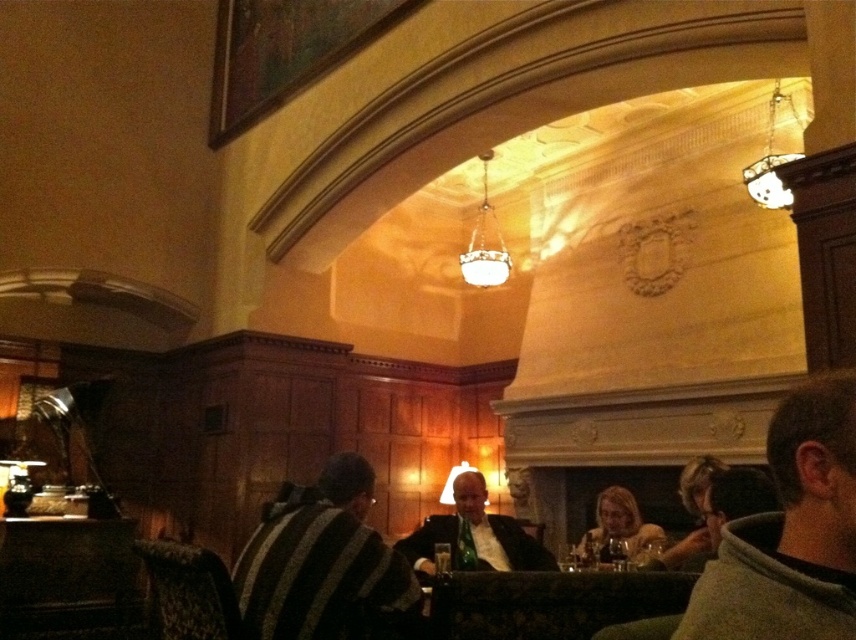
Question: Among these objects, which one is farthest from the camera?

Choices:
 (A) light brown leather jacket at center
 (B) dark gray sweater at right
 (C) matte black suit at center

Answer: (A)

Question: Observing the image, what is the correct spatial positioning of light brown leather jacket at center in reference to white glass chandelier at center?

Choices:
 (A) above
 (B) below

Answer: (B)

Question: Estimate the real-world distances between objects in this image. Which object is farther from the light brown leather jacket at center?

Choices:
 (A) matte black suit at center
 (B) striped sweater at center
 (C) wooden table at center

Answer: (B)

Question: Does matte black suit at center appear on the right side of light brown leather jacket at center?

Choices:
 (A) yes
 (B) no

Answer: (B)

Question: Does wooden table at center come in front of matte black suit at center?

Choices:
 (A) no
 (B) yes

Answer: (B)

Question: Which of the following is the farthest from the observer?

Choices:
 (A) matte black suit at center
 (B) dark gray sweater at right
 (C) light brown leather jacket at center
 (D) white glass chandelier at center

Answer: (D)